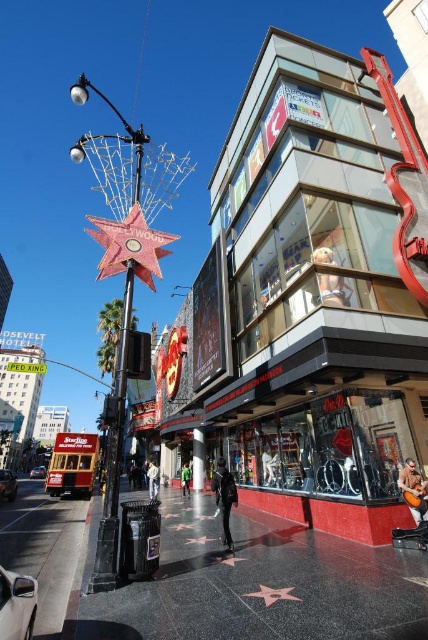
Question: Does concrete sidewalk at center appear on the right side of gold reflective star at center?

Choices:
 (A) no
 (B) yes

Answer: (B)

Question: Among these points, which one is nearest to the camera?

Choices:
 (A) (291, 589)
 (B) (418, 563)

Answer: (A)

Question: Which is farther from the concrete sidewalk at center?

Choices:
 (A) gold reflective star at center
 (B) pink polished star at center

Answer: (A)

Question: Does concrete sidewalk at center have a larger size compared to gold reflective star at center?

Choices:
 (A) no
 (B) yes

Answer: (B)

Question: Which point is closer to the camera?

Choices:
 (A) coord(284,637)
 (B) coord(226,564)

Answer: (A)

Question: Is concrete sidewalk at center wider than pink polished star at center?

Choices:
 (A) no
 (B) yes

Answer: (B)